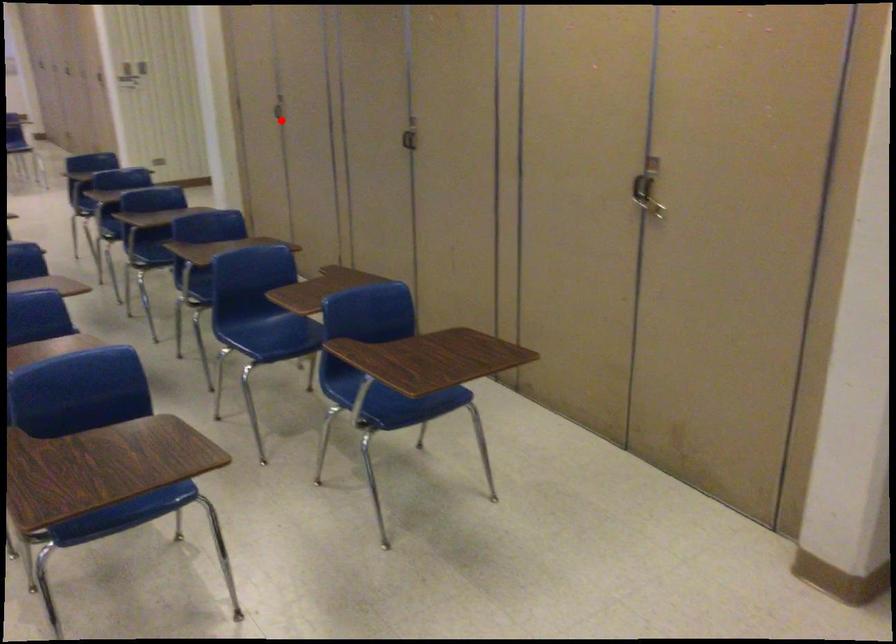
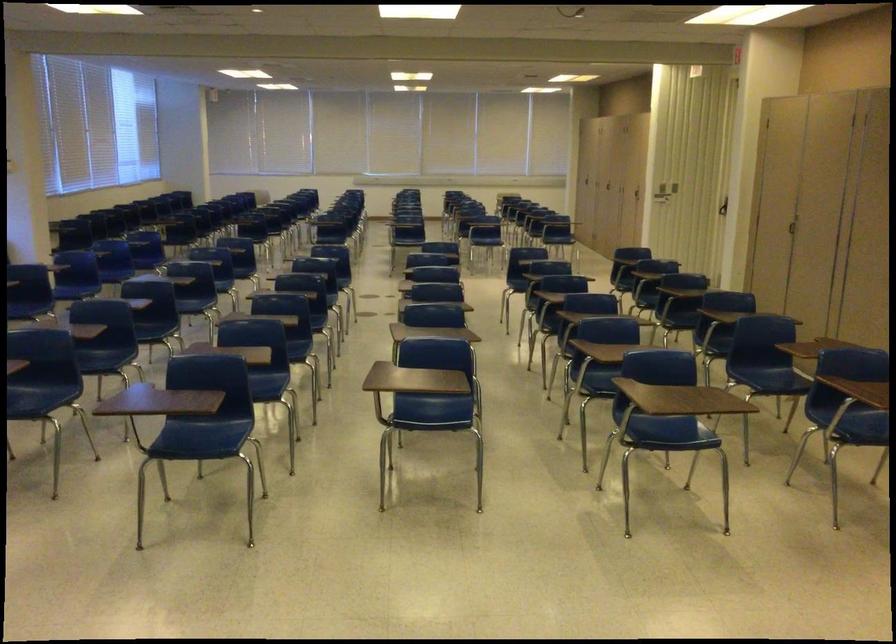
Where in the second image is the point corresponding to the highlighted location from the first image?

(794, 228)